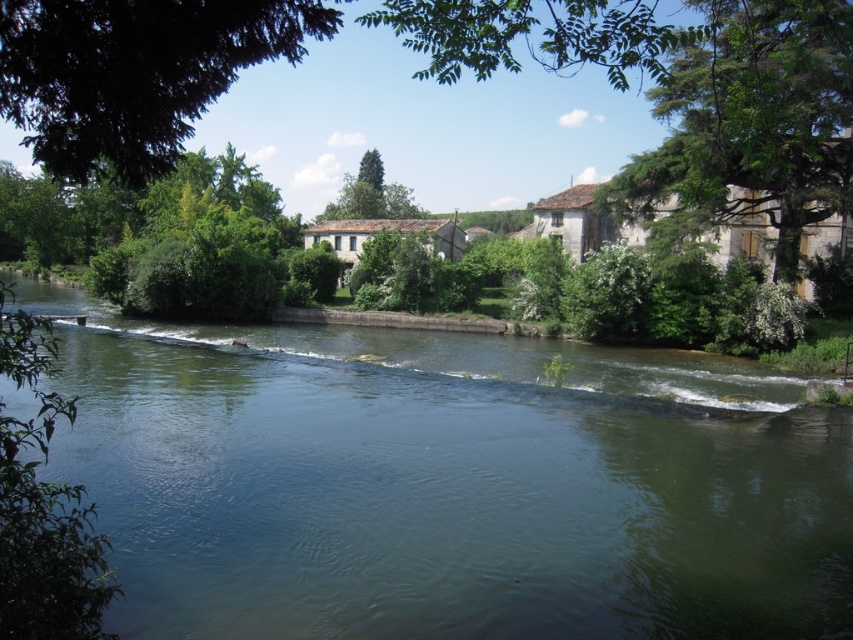
You are a photographer standing at the riverside. You want to take a photo that includes both the green water at center and the green leafy tree at upper left. Given that your camera has a maximum focus range of 12 meters, will you be able to capture both subjects in focus without moving your position?

The green water at center and green leafy tree at upper left are 13.49 meters apart. Since the maximum focus range of your camera is 12 meters, you will not be able to capture both subjects in focus without moving your position.

You are standing at the riverside and want to locate two points marked in the image. Which point, point [793,218] or point [392,204], is nearer to your current position?

Point [793,218] is closer to the camera than point [392,204], so it is nearer to your current position.

You are a hiker standing at the edge of the river. You see the green water at center and the green leafy tree at upper left. Which object is closer to the water surface?

The green water at center is located below the green leafy tree at upper left, so the green water at center is closer to the water surface.